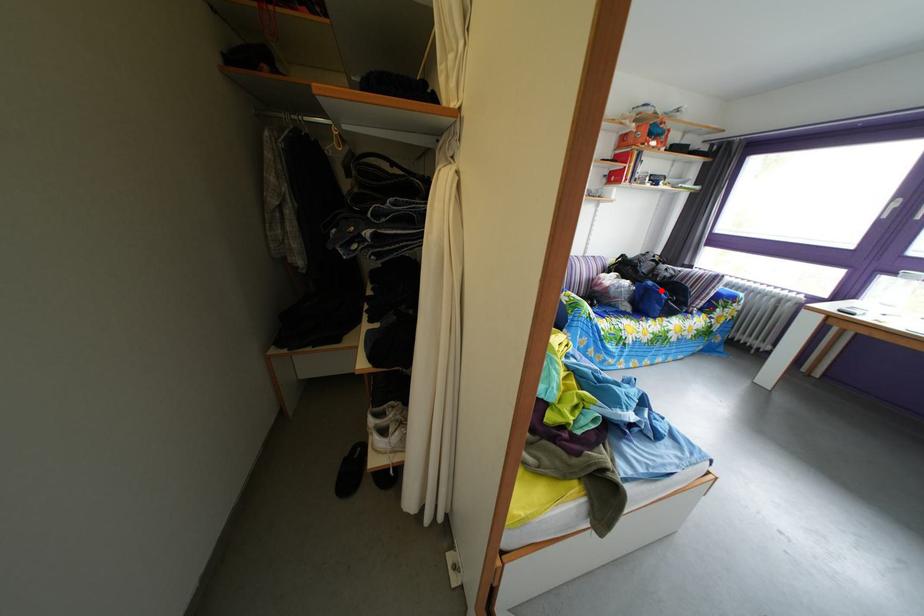
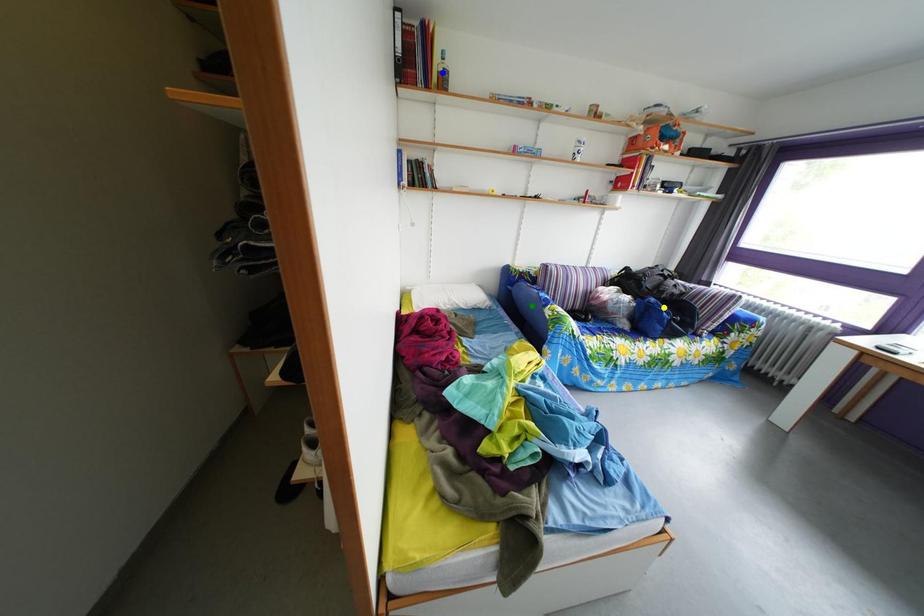
Question: I am providing you with two images of the same scene from different viewpoints. A red point is marked on the first image. You are given multiple points on the second image. In image 2, which mark is for the same physical point as the one in image 1?

Choices:
 (A) yellow point
 (B) blue point
 (C) green point

Answer: (A)